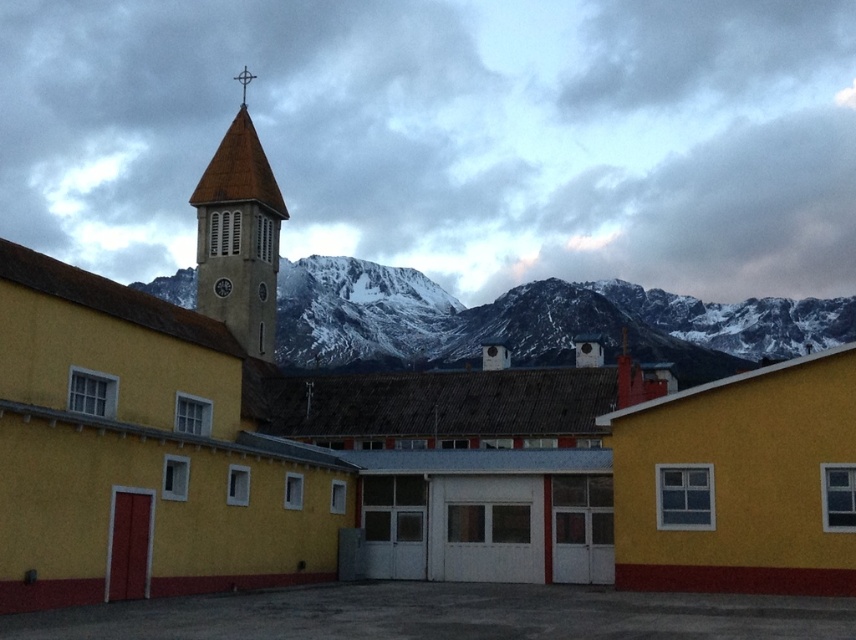
Who is taller, snowy rock formation at upper center or brown tiled bell tower at upper left?

brown tiled bell tower at upper left

Is point (352, 280) farther from viewer compared to point (236, 230)?

Yes, point (352, 280) is behind point (236, 230).

Image resolution: width=856 pixels, height=640 pixels. I want to click on snowy rock formation at upper center, so click(x=532, y=321).

Where is `snowy rock formation at upper center`? snowy rock formation at upper center is located at coordinates pyautogui.click(x=532, y=321).